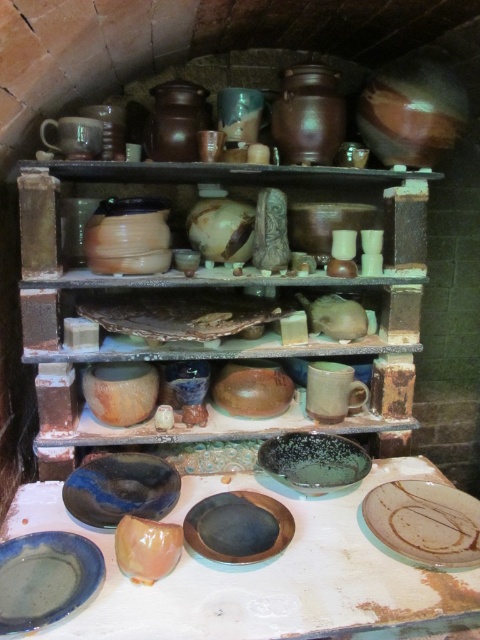
You are an artisan checking the kiln. You have a new ceramic piece that is 12 inches wide. You want to place it on the shelf where the matte ceramic plate at center and blue glossy plate at center are already placed. Can the new piece fit alongside them without overlapping?

The matte ceramic plate at center is larger than the blue glossy plate at center. Since the new piece is 12 inches wide, you should compare its size with the largest existing plate. If the matte ceramic plate at center is wider than 12 inches, the new piece can fit alongside without overlapping. If the matte ceramic plate at center is narrower, then the new piece might not fit. However, without knowing the exact dimensions of the existing plates, it is uncertain. Please check the size of the matte ceramic p

You are a pottery artist who needs to place a new ceramic piece between the green matte plate at center and the matte blue plate at lower left. The new piece is 30 centimeters wide. Is there enough space between them to fit the new piece?

The distance between the green matte plate at center and the matte blue plate at lower left is 60.85 centimeters. Since the new piece is 30 centimeters wide, there is sufficient space to place it between them.